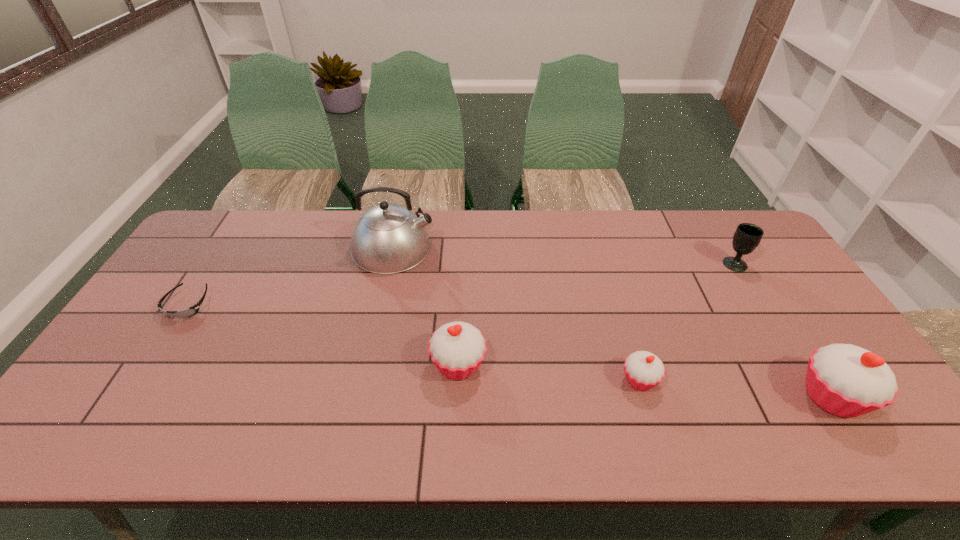
Please show where to add a cupcake on the left while keeping spacing even. Please provide its 2D coordinates. Your answer should be formatted as a tuple, i.e. [(x, y)], where the tuple contains the x and y coordinates of a point satisfying the conditions above.

[(288, 350)]